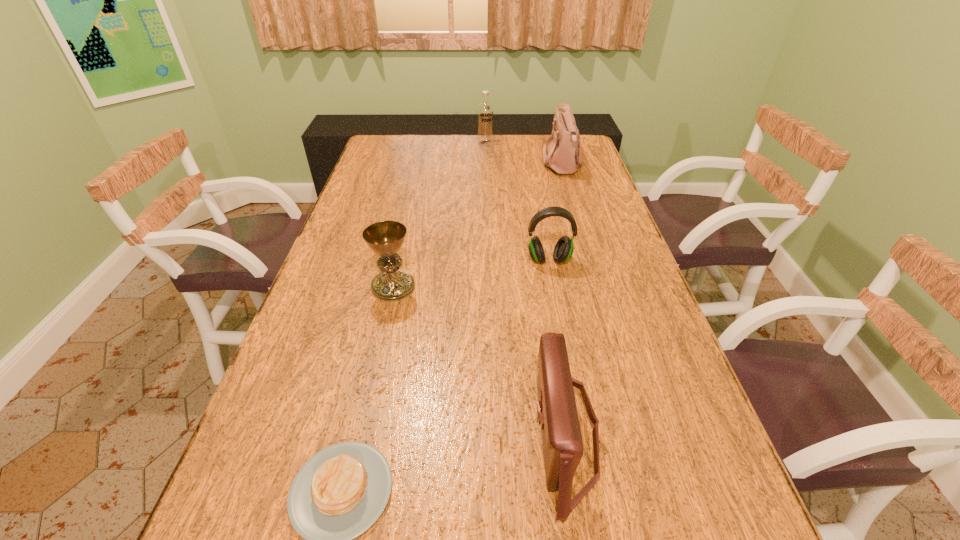
Identify the location of free space located on the front pocket of the farther shoulder bag. This screenshot has height=540, width=960. tap(503, 164).

You are a GUI agent. You are given a task and a screenshot of the screen. Output one action in this format:
    pyautogui.click(x=<x>, y=<y>)
    Task: Click on the vacant space located 0.050m on the right of the chalice
    The image size is (960, 540).
    Given the screenshot: What is the action you would take?
    pyautogui.click(x=434, y=287)

Where is `free point located 0.330m on the ear cups of the fourth nearest object`? Image resolution: width=960 pixels, height=540 pixels. free point located 0.330m on the ear cups of the fourth nearest object is located at coordinates (568, 366).

The width and height of the screenshot is (960, 540). In order to click on vacant position located on the front flap of the nearer shoulder bag in this screenshot , I will do [x=482, y=434].

This screenshot has width=960, height=540. In order to click on free space located on the front flap of the nearer shoulder bag in this screenshot , I will do `click(335, 434)`.

The height and width of the screenshot is (540, 960). In order to click on vacant space located on the front flap of the nearer shoulder bag in this screenshot , I will do `click(350, 434)`.

You are a GUI agent. You are given a task and a screenshot of the screen. Output one action in this format:
    pyautogui.click(x=<x>, y=<y>)
    Task: Click on the vodka present at the far edge
    The image size is (960, 540).
    Given the screenshot: What is the action you would take?
    pyautogui.click(x=485, y=110)

This screenshot has height=540, width=960. Find the location of `shoulder bag at the far edge`. shoulder bag at the far edge is located at coordinates (561, 157).

Locate an element on the screen. The height and width of the screenshot is (540, 960). object that is positioned at the left edge is located at coordinates (385, 238).

The width and height of the screenshot is (960, 540). What are the coordinates of `object located in the right edge section of the desktop` in the screenshot? It's located at (561, 157).